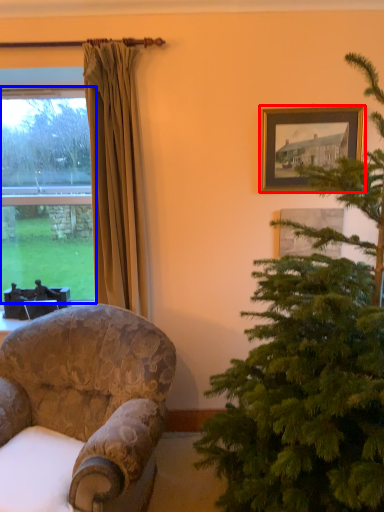
Question: Which object is further to the camera taking this photo, picture frame (highlighted by a red box) or window (highlighted by a blue box)?

Choices:
 (A) picture frame
 (B) window

Answer: (B)